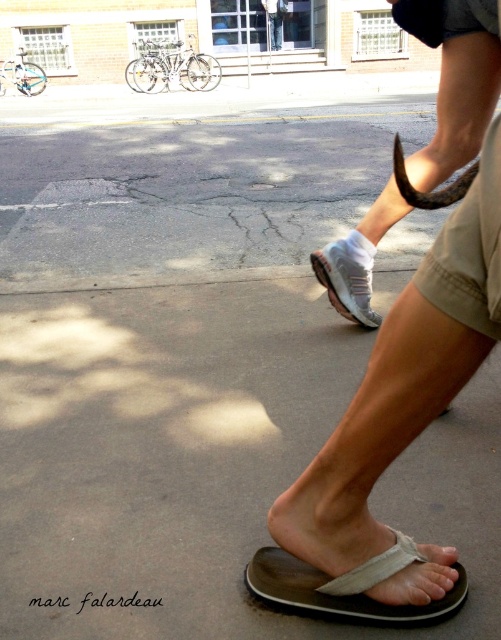
You are a delivery robot that needs to place a small package between the gray fabric sandal at lower center and the white mesh shoe at center. Can you fit the package there if it requires 1 meter of space?

The gray fabric sandal at lower center and the white mesh shoe at center are 1.29 meters apart from each other, so yes, the delivery robot can fit the package between them since the required space is 1 meter.

You are trying to decide which item to take from the scene to protect your foot. The white fabric sock at upper center and the white mesh shoe at center are both options. Which one is larger in size?

The white fabric sock at upper center is bigger than the white mesh shoe at center, so it would be the larger option for foot protection.